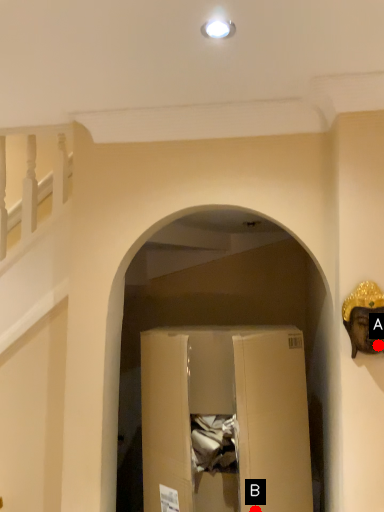
Question: Two points are circled on the image, labeled by A and B beside each circle. Which point is closer to the camera taking this photo?

Choices:
 (A) A is closer
 (B) B is closer

Answer: (A)